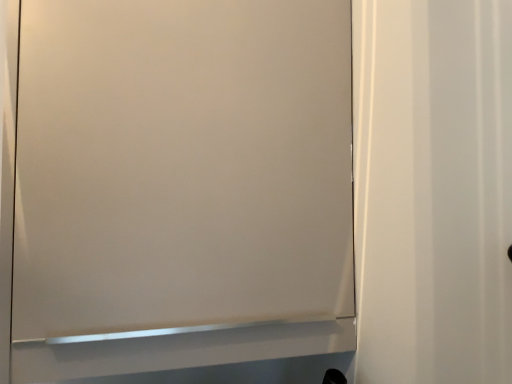
Where is `satin white door at center`? The height and width of the screenshot is (384, 512). satin white door at center is located at coordinates (181, 165).

The width and height of the screenshot is (512, 384). What do you see at coordinates (181, 165) in the screenshot? I see `satin white door at center` at bounding box center [181, 165].

In order to face satin white door at center, should I rotate leftwards or rightwards?

You should look left and rotate roughly 9.629 degrees.

The height and width of the screenshot is (384, 512). In order to click on satin white door at center in this screenshot , I will do `click(181, 165)`.